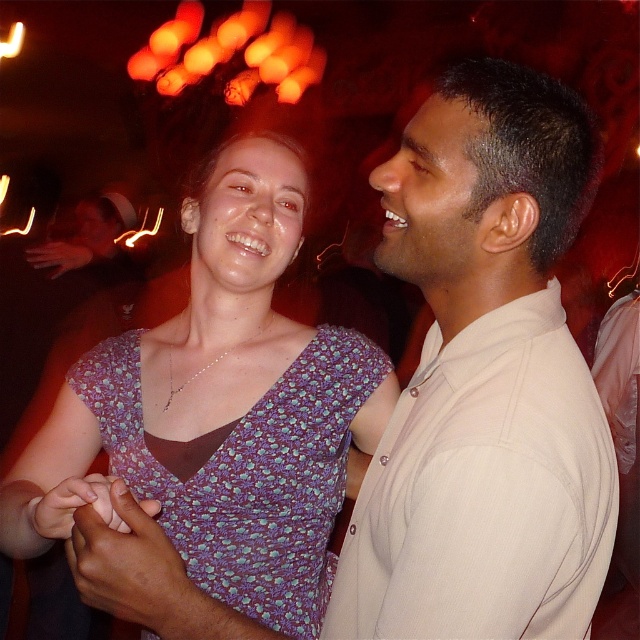
Question: Which of the following is the farthest from the observer?

Choices:
 (A) white smooth shirt at right
 (B) purple floral fabric dress at center

Answer: (B)

Question: Which of the following is the farthest from the observer?

Choices:
 (A) (304, 396)
 (B) (436, 324)

Answer: (A)

Question: Is white smooth shirt at right above purple floral fabric dress at center?

Choices:
 (A) no
 (B) yes

Answer: (B)

Question: Which of the following is the farthest from the observer?

Choices:
 (A) white smooth shirt at right
 (B) purple floral fabric dress at center

Answer: (B)

Question: Is white smooth shirt at right bigger than purple floral fabric dress at center?

Choices:
 (A) yes
 (B) no

Answer: (B)

Question: Does white smooth shirt at right lie behind purple floral fabric dress at center?

Choices:
 (A) yes
 (B) no

Answer: (B)